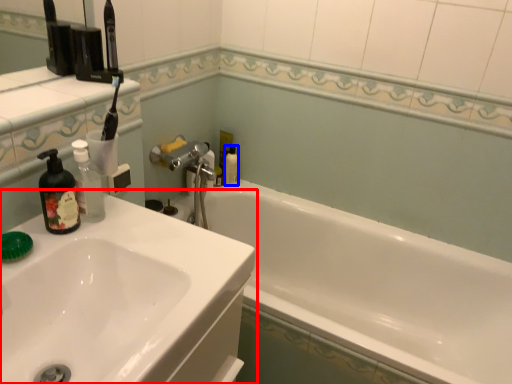
Question: Which object is closer to the camera taking this photo, sink (highlighted by a red box) or mouthwash (highlighted by a blue box)?

Choices:
 (A) sink
 (B) mouthwash

Answer: (A)